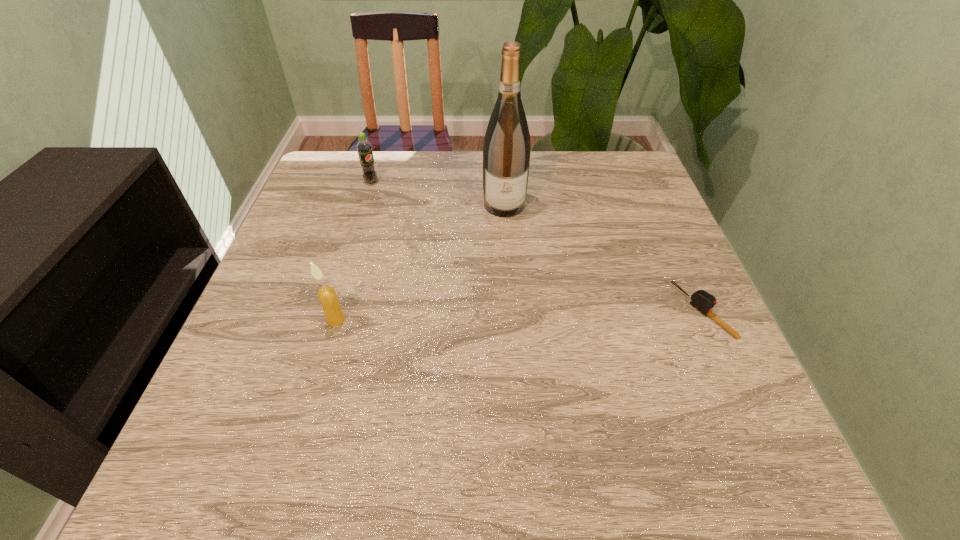
At what (x,y) coordinates should I click in order to perform the action: click on free space between the wine bottle and the tape measure. Please return your answer as a coordinate pair (x, y). Looking at the image, I should click on (604, 258).

Locate an element on the screen. vacant region between the rightmost object and the second farthest object is located at coordinates (604, 258).

You are a GUI agent. You are given a task and a screenshot of the screen. Output one action in this format:
    pyautogui.click(x=<x>, y=<y>)
    Task: Click on the vacant area that lies between the tape measure and the candle
    Image resolution: width=960 pixels, height=540 pixels.
    Given the screenshot: What is the action you would take?
    pyautogui.click(x=519, y=315)

Where is `blank region between the candle and the third tallest object`? This screenshot has height=540, width=960. blank region between the candle and the third tallest object is located at coordinates (353, 251).

This screenshot has height=540, width=960. I want to click on free spot between the rightmost object and the second shortest object, so click(538, 247).

Find the location of a particular element. This screenshot has width=960, height=540. free spot between the candle and the second shortest object is located at coordinates (353, 251).

What are the coordinates of `free point between the tallest object and the candle` in the screenshot? It's located at (420, 262).

Identify which object is the nearest to the farthest object. Please provide its 2D coordinates. Your answer should be formatted as a tuple, i.e. [(x, y)], where the tuple contains the x and y coordinates of a point satisfying the conditions above.

[(506, 152)]

Locate which object is the second closest to the tallest object. Please provide its 2D coordinates. Your answer should be formatted as a tuple, i.e. [(x, y)], where the tuple contains the x and y coordinates of a point satisfying the conditions above.

[(703, 301)]

Locate an element on the screen. Image resolution: width=960 pixels, height=540 pixels. vacant point that satisfies the following two spatial constraints: 1. on the front side of the farthest object; 2. on the left side of the rightmost object is located at coordinates (332, 311).